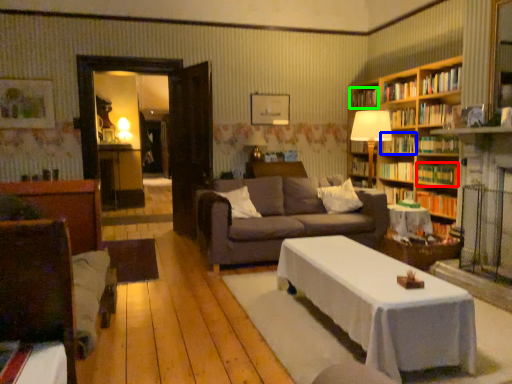
Question: Estimate the real-world distances between objects in this image. Which object is closer to book (highlighted by a red box), book (highlighted by a blue box) or book (highlighted by a green box)?

Choices:
 (A) book
 (B) book

Answer: (A)